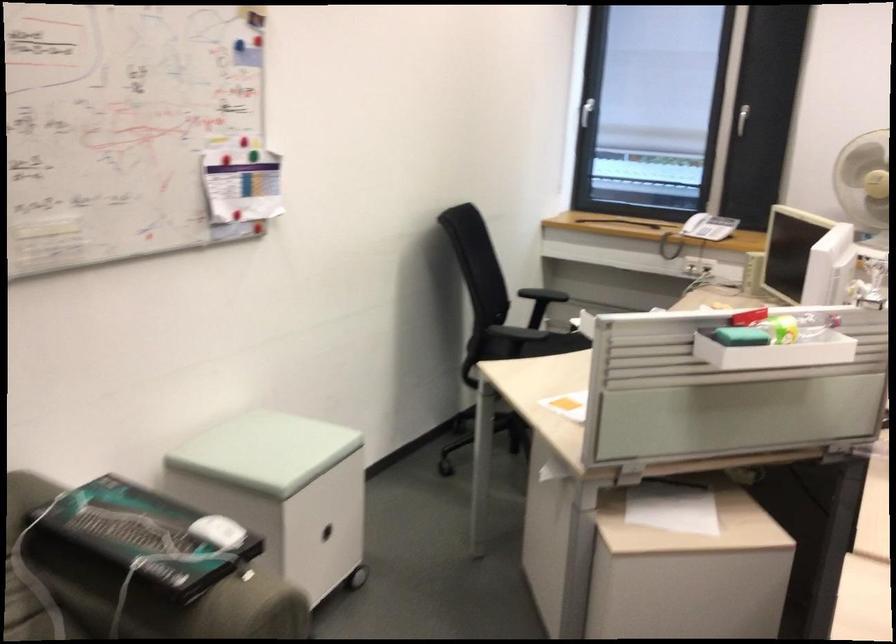
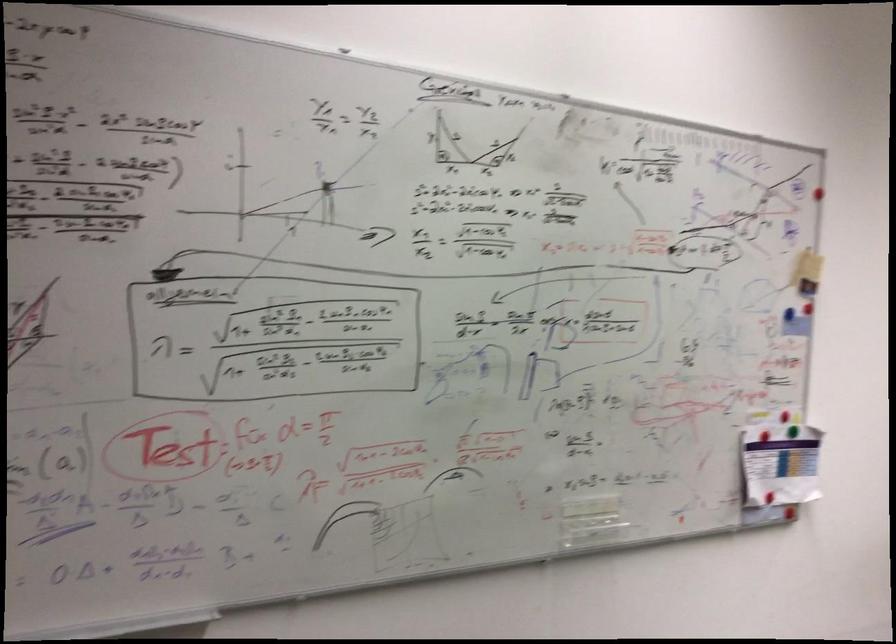
Question: I am providing you with two images of the same scene from different viewpoints. After the viewpoint changes to image2, which objects are now occluded?

Choices:
 (A) blue magnet
 (B) whiteboard pen tray
 (C) red magnet
 (D) none of these

Answer: (D)